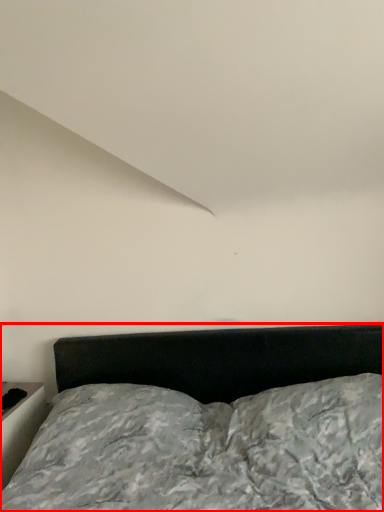
Question: Where is bed (annotated by the red box) located in relation to table in the image?

Choices:
 (A) right
 (B) left

Answer: (A)